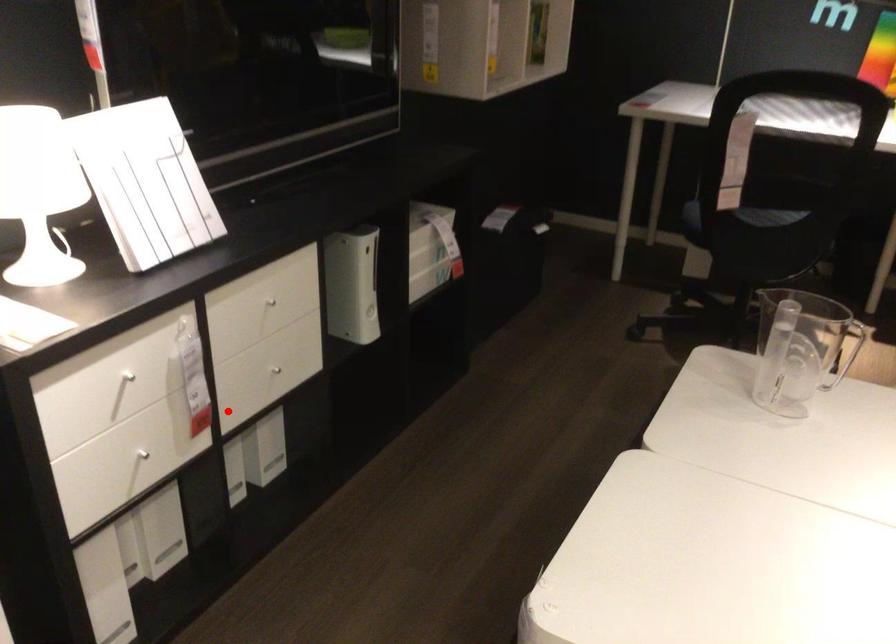
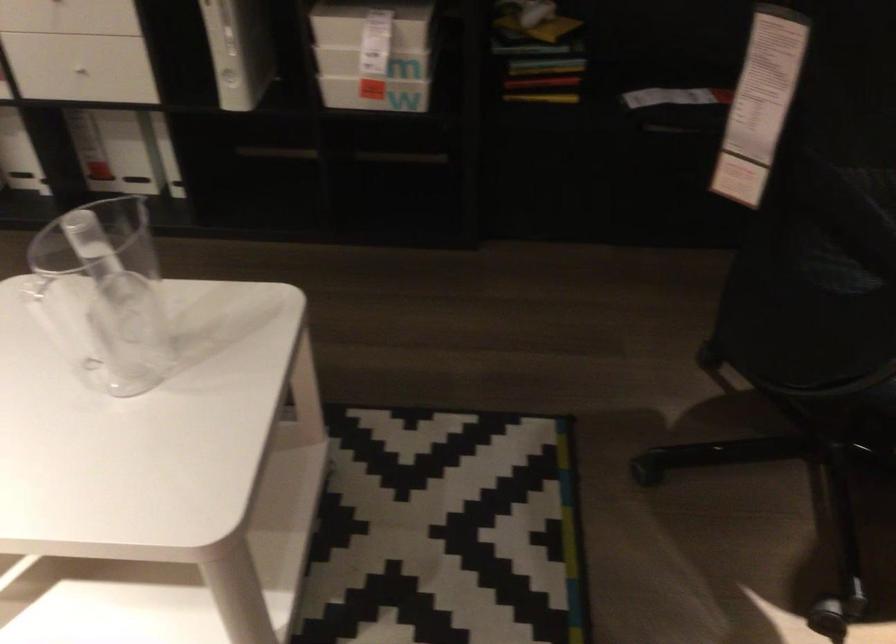
Question: I am providing you with two images of the same scene from different viewpoints. A red point is marked on the first image. Can you still see the location of the red point in image 2?

Choices:
 (A) Yes
 (B) No

Answer: (A)